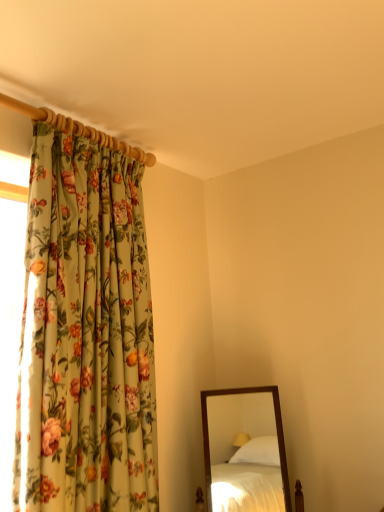
Question: Can you confirm if floral fabric curtain at left is bigger than wooden-framed mirror at lower right?

Choices:
 (A) no
 (B) yes

Answer: (B)

Question: From a real-world perspective, is floral fabric curtain at left beneath wooden-framed mirror at lower right?

Choices:
 (A) no
 (B) yes

Answer: (A)

Question: Is floral fabric curtain at left positioned with its back to wooden-framed mirror at lower right?

Choices:
 (A) no
 (B) yes

Answer: (A)

Question: Is floral fabric curtain at left positioned before wooden-framed mirror at lower right?

Choices:
 (A) no
 (B) yes

Answer: (B)

Question: Considering the relative sizes of floral fabric curtain at left and wooden-framed mirror at lower right in the image provided, is floral fabric curtain at left thinner than wooden-framed mirror at lower right?

Choices:
 (A) yes
 (B) no

Answer: (A)

Question: Would you say floral fabric curtain at left is a long distance from wooden-framed mirror at lower right?

Choices:
 (A) yes
 (B) no

Answer: (A)

Question: From the image's perspective, is wooden-framed mirror at lower right above floral fabric curtain at left?

Choices:
 (A) no
 (B) yes

Answer: (A)

Question: Is wooden-framed mirror at lower right positioned behind floral fabric curtain at left?

Choices:
 (A) yes
 (B) no

Answer: (A)

Question: Is wooden-framed mirror at lower right in contact with floral fabric curtain at left?

Choices:
 (A) no
 (B) yes

Answer: (A)

Question: Is wooden-framed mirror at lower right positioned beyond the bounds of floral fabric curtain at left?

Choices:
 (A) yes
 (B) no

Answer: (A)

Question: Considering the relative positions of wooden-framed mirror at lower right and floral fabric curtain at left in the image provided, is wooden-framed mirror at lower right to the right of floral fabric curtain at left from the viewer's perspective?

Choices:
 (A) no
 (B) yes

Answer: (B)

Question: From a real-world perspective, does wooden-framed mirror at lower right sit lower than floral fabric curtain at left?

Choices:
 (A) yes
 (B) no

Answer: (A)

Question: Looking at their shapes, would you say floral fabric curtain at left is wider or thinner than wooden-framed mirror at lower right?

Choices:
 (A) thin
 (B) wide

Answer: (A)